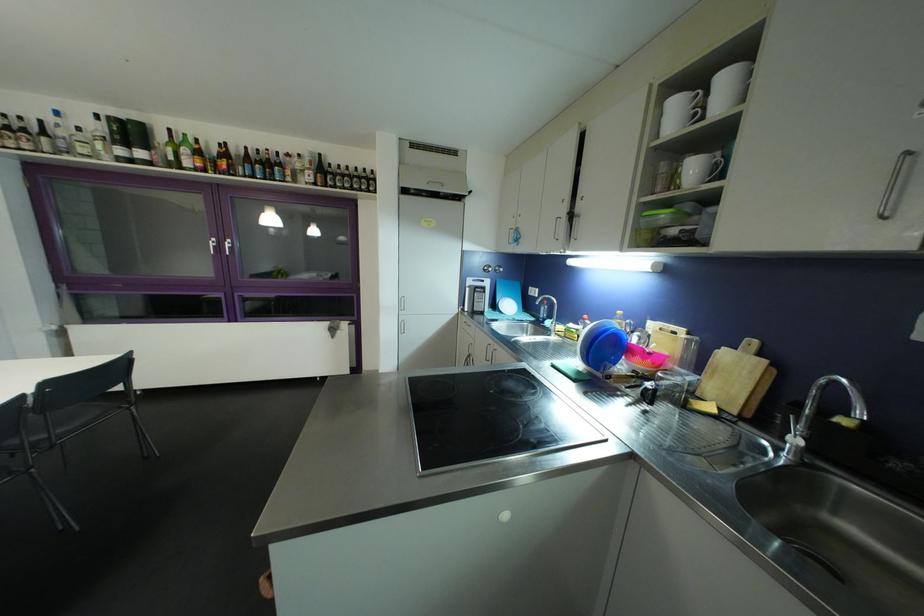
This screenshot has height=616, width=924. Find the location of `faucet lever`. faucet lever is located at coordinates (794, 440).